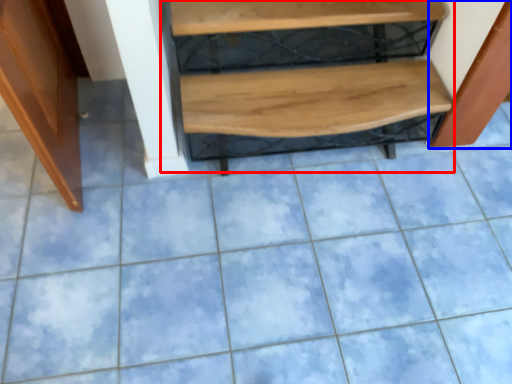
Question: Which object is closer to the camera taking this photo, stairwell (highlighted by a red box) or cabinetry (highlighted by a blue box)?

Choices:
 (A) stairwell
 (B) cabinetry

Answer: (B)